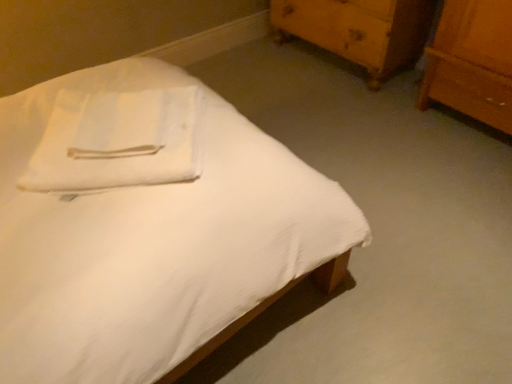
What do you see at coordinates (117, 141) in the screenshot? I see `white cotton towel at upper left` at bounding box center [117, 141].

I want to click on wooden chest of drawers at upper right, so click(359, 30).

Which of these two, white matte bed at center or wooden chest of drawers at upper right, is thinner?

wooden chest of drawers at upper right.

Is white matte bed at center positioned with its back to wooden chest of drawers at upper right?

No, wooden chest of drawers at upper right is not at the back of white matte bed at center.

Find the location of `bed in front of the wooden chest of drawers at upper right`. bed in front of the wooden chest of drawers at upper right is located at coordinates (145, 223).

Does white matte bed at center touch white cotton towel at upper left?

No, white matte bed at center is not beside white cotton towel at upper left.

Looking at this image, between white matte bed at center and white cotton towel at upper left, which one appears on the right side from the viewer's perspective?

white matte bed at center.

From the image's perspective, is white matte bed at center beneath white cotton towel at upper left?

Indeed, from the image's perspective, white matte bed at center is shown beneath white cotton towel at upper left.

Which object is thinner, wooden chest of drawers at upper right or white cotton towel at upper left?

Thinner between the two is white cotton towel at upper left.

Is point (391, 53) less distant than point (191, 110)?

No.

From a real-world perspective, which is physically above, wooden chest of drawers at upper right or white cotton towel at upper left?

white cotton towel at upper left is physically above.

From the image's perspective, is wooden chest of drawers at upper right above or below white cotton towel at upper left?

wooden chest of drawers at upper right is situated higher than white cotton towel at upper left in the image.

From the image's perspective, is white cotton towel at upper left located beneath wooden chest of drawers at upper right?

Yes, from the image's perspective, white cotton towel at upper left is beneath wooden chest of drawers at upper right.

Looking at this image, from a real-world perspective, is white cotton towel at upper left positioned above or below wooden chest of drawers at upper right?

From a real-world perspective, white cotton towel at upper left is physically above wooden chest of drawers at upper right.

In terms of size, does white cotton towel at upper left appear bigger or smaller than wooden chest of drawers at upper right?

In the image, white cotton towel at upper left appears to be smaller than wooden chest of drawers at upper right.

Is white cotton towel at upper left at the left side of wooden chest of drawers at upper right?

Indeed, white cotton towel at upper left is positioned on the left side of wooden chest of drawers at upper right.

Could you tell me if wooden chest of drawers at upper right is turned towards white matte bed at center?

Yes, wooden chest of drawers at upper right is turned towards white matte bed at center.

Is the position of wooden chest of drawers at upper right less distant than that of white matte bed at center?

No, wooden chest of drawers at upper right is further to the viewer.

Based on the photo, from the image's perspective, between wooden chest of drawers at upper right and white matte bed at center, who is located below?

white matte bed at center is shown below in the image.

How different are the orientations of wooden chest of drawers at upper right and white matte bed at center in degrees?

There is a 180-degree angle between the facing directions of wooden chest of drawers at upper right and white matte bed at center.

Is white cotton towel at upper left positioned far away from white matte bed at center?

No, white cotton towel at upper left is not far away from white matte bed at center.

Which is behind, white cotton towel at upper left or white matte bed at center?

Positioned behind is white cotton towel at upper left.

Is white cotton towel at upper left spatially inside white matte bed at center, or outside of it?

white cotton towel at upper left can be found inside white matte bed at center.

Is white cotton towel at upper left turned away from white matte bed at center?

Absolutely, white cotton towel at upper left is directed away from white matte bed at center.

Where is `the chest of drawers behind the white matte bed at center`? the chest of drawers behind the white matte bed at center is located at coordinates (359, 30).

Find the location of a particular element. The width and height of the screenshot is (512, 384). cloth lying above the white matte bed at center (from the image's perspective) is located at coordinates (117, 141).

Which object lies further to the anchor point white matte bed at center, wooden chest of drawers at upper right or white cotton towel at upper left?

wooden chest of drawers at upper right.

When comparing their distances from white cotton towel at upper left, does wooden chest of drawers at upper right or white matte bed at center seem closer?

Among the two, white matte bed at center is located nearer to white cotton towel at upper left.

Based on their spatial positions, is white cotton towel at upper left or wooden chest of drawers at upper right closer to white matte bed at center?

Among the two, white cotton towel at upper left is located nearer to white matte bed at center.

Estimate the real-world distances between objects in this image. Which object is closer to wooden chest of drawers at upper right, white cotton towel at upper left or white matte bed at center?

The object closer to wooden chest of drawers at upper right is white matte bed at center.

Looking at this image, estimate the real-world distances between objects in this image. Which object is further from white cotton towel at upper left, white matte bed at center or wooden chest of drawers at upper right?

Among the two, wooden chest of drawers at upper right is located further to white cotton towel at upper left.

Which object lies nearer to the anchor point wooden chest of drawers at upper right, white matte bed at center or white cotton towel at upper left?

The object closer to wooden chest of drawers at upper right is white matte bed at center.

Find the location of a particular element. Image resolution: width=512 pixels, height=384 pixels. cloth between white matte bed at center and wooden chest of drawers at upper right from front to back is located at coordinates (117, 141).